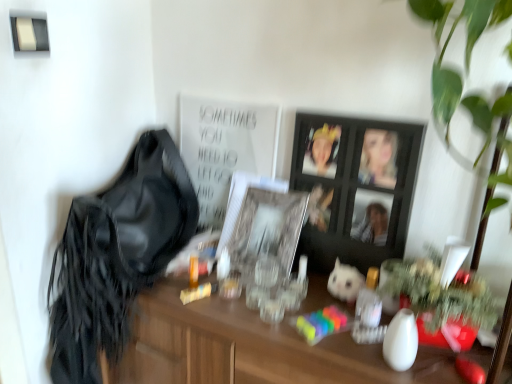
Question: Considering the positions of clear glass picture frame at center, which is counted as the first picture frame, starting from the left, and white plush toy at center in the image, is clear glass picture frame at center, which is counted as the first picture frame, starting from the left, bigger or smaller than white plush toy at center?

Choices:
 (A) big
 (B) small

Answer: (A)

Question: From a real-world perspective, is clear glass picture frame at center, which is counted as the first picture frame, starting from the left, above or below white plush toy at center?

Choices:
 (A) above
 (B) below

Answer: (A)

Question: Which object is positioned closest to the clear glass picture frame at center, acting as the 2th picture frame starting from the right?

Choices:
 (A) satin black shoulder bag at left
 (B) black wooden picture frame at center, arranged as the second picture frame when viewed from the left
 (C) white plush toy at center
 (D) white matte poster at upper center

Answer: (B)

Question: Which of these objects is positioned farthest from the white plush toy at center?

Choices:
 (A) black wooden picture frame at center, acting as the 1th picture frame starting from the right
 (B) white matte poster at upper center
 (C) satin black shoulder bag at left
 (D) clear glass picture frame at center, acting as the 2th picture frame starting from the right

Answer: (C)